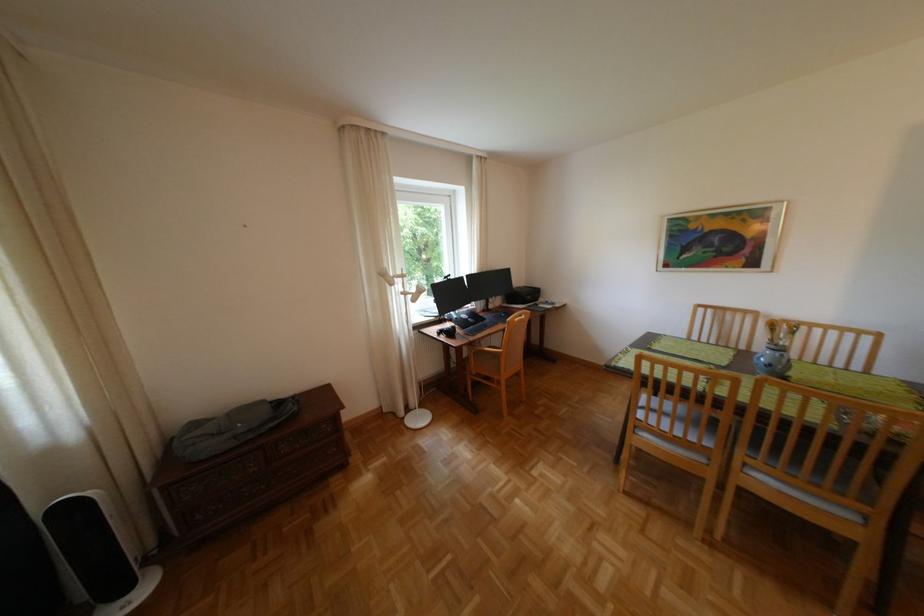
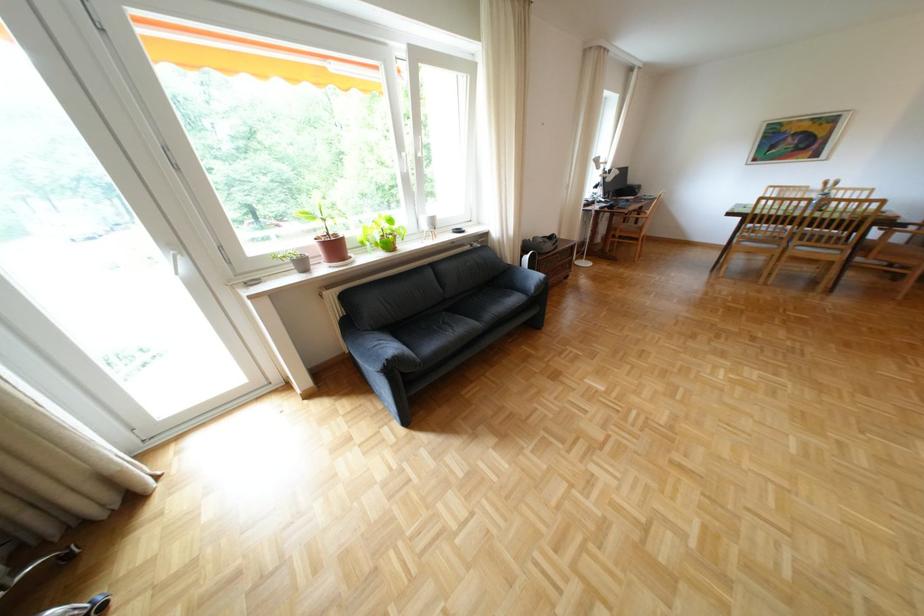
The images are taken continuously from a first-person perspective. In which direction are you moving?

The cameraman walked toward left, backward.